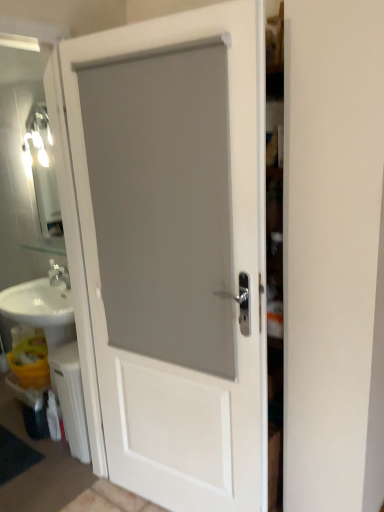
Describe the element at coordinates (71, 398) in the screenshot. The image size is (384, 512). I see `white plastic radiator at lower left` at that location.

Locate an element on the screen. Image resolution: width=384 pixels, height=512 pixels. white plastic radiator at lower left is located at coordinates (71, 398).

In order to face white matte door at center, should I rotate leftwards or rightwards?

You should rotate left by 3.916 degrees.

Measure the distance between white matte door at center and camera.

The depth of white matte door at center is 4.03 feet.

What is the approximate width of white matte door at center?

It is 4.74 inches.

In order to click on white matte door at center in this screenshot , I will do `click(183, 279)`.

What do you see at coordinates (183, 279) in the screenshot? This screenshot has width=384, height=512. I see `white matte door at center` at bounding box center [183, 279].

Locate an element on the screen. white plastic radiator at lower left is located at coordinates (71, 398).

Is white plastic radiator at lower left to the left of white matte door at center from the viewer's perspective?

Indeed, white plastic radiator at lower left is positioned on the left side of white matte door at center.

In the image, is white plastic radiator at lower left positioned in front of or behind white matte door at center?

Clearly, white plastic radiator at lower left is behind white matte door at center.

Considering the positions of points (79, 400) and (243, 201), is point (79, 400) farther from camera compared to point (243, 201)?

Yes.

From the image's perspective, is white plastic radiator at lower left over white matte door at center?

No, from the image's perspective, white plastic radiator at lower left is not on top of white matte door at center.

From a real-world perspective, is white plastic radiator at lower left on white matte door at center?

Actually, white plastic radiator at lower left is physically below white matte door at center in the real world.

Is white plastic radiator at lower left wider than white matte door at center?

Yes.

Looking at this image, which of these two, white plastic radiator at lower left or white matte door at center, stands shorter?

Standing shorter between the two is white plastic radiator at lower left.

Who is bigger, white plastic radiator at lower left or white matte door at center?

white matte door at center is bigger.

Is white matte door at center a part of white plastic radiator at lower left?

No, white matte door at center is located outside of white plastic radiator at lower left.

Is the surface of white plastic radiator at lower left in direct contact with white matte door at center?

No.

Is white matte door at center at the back of white plastic radiator at lower left?

white plastic radiator at lower left is not turned away from white matte door at center.

Locate an element on the screen. The height and width of the screenshot is (512, 384). radiator below the white matte door at center (from a real-world perspective) is located at coordinates (71, 398).

Which is more to the left, white matte door at center or white plastic radiator at lower left?

white plastic radiator at lower left is more to the left.

Which is behind, white matte door at center or white plastic radiator at lower left?

white plastic radiator at lower left is further away from the camera.

Does point (106, 270) lie in front of point (65, 397)?

Yes, point (106, 270) is closer to viewer.

From the image's perspective, does white matte door at center appear higher than white plastic radiator at lower left?

Indeed, from the image's perspective, white matte door at center is shown above white plastic radiator at lower left.

From a real-world perspective, is white matte door at center physically below white plastic radiator at lower left?

No, from a real-world perspective, white matte door at center is not under white plastic radiator at lower left.

Based on the photo, does white matte door at center have a greater width compared to white plastic radiator at lower left?

In fact, white matte door at center might be narrower than white plastic radiator at lower left.

Between white matte door at center and white plastic radiator at lower left, which one has more height?

With more height is white matte door at center.

Which of these two, white matte door at center or white plastic radiator at lower left, is bigger?

white matte door at center is bigger.

From the picture: Is white plastic radiator at lower left a part of white matte door at center?

No, white plastic radiator at lower left is not a part of white matte door at center.

Is white matte door at center far from white plastic radiator at lower left?

No, white matte door at center is in close proximity to white plastic radiator at lower left.

Is white matte door at center facing away from white plastic radiator at lower left?

That's not correct — white matte door at center is not looking away from white plastic radiator at lower left.

How different are the orientations of white matte door at center and white plastic radiator at lower left in degrees?

There is a 3.65-degree angle between the facing directions of white matte door at center and white plastic radiator at lower left.

Identify the location of door located above the white plastic radiator at lower left (from a real-world perspective). (183, 279).

Find the location of a particular element. door located on the right of white plastic radiator at lower left is located at coordinates (183, 279).

Find the location of a particular element. radiator below the white matte door at center (from a real-world perspective) is located at coordinates (71, 398).